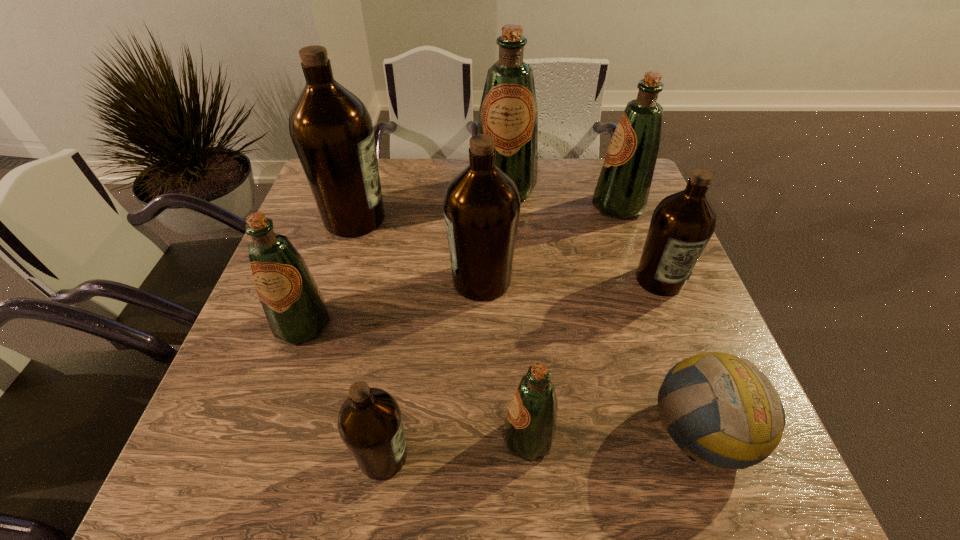
You are a GUI agent. You are given a task and a screenshot of the screen. Output one action in this format:
    pyautogui.click(x=<x>, y=<y>)
    Task: Click on the object that is at the far right corner
    
    Given the screenshot: What is the action you would take?
    pyautogui.click(x=622, y=190)

Image resolution: width=960 pixels, height=540 pixels. Identify the location of object that is at the near right corner. (742, 419).

This screenshot has height=540, width=960. Identify the location of vacant region at the far edge of the desktop. (385, 195).

Image resolution: width=960 pixels, height=540 pixels. What are the coordinates of `blank space at the near edge` in the screenshot? It's located at (463, 461).

Identify the location of free space at the left edge. (306, 264).

Image resolution: width=960 pixels, height=540 pixels. In the image, there is a desktop. In order to click on free region at the right edge in this screenshot , I will do `click(658, 340)`.

The width and height of the screenshot is (960, 540). In the image, there is a desktop. Find the location of `blank space at the far left corner`. blank space at the far left corner is located at coordinates pyautogui.click(x=310, y=203).

Image resolution: width=960 pixels, height=540 pixels. I want to click on vacant area that lies between the third object from left to right and the rightmost green olive oil, so click(x=501, y=331).

Locate an element on the screen. free point between the leftmost green olive oil and the shortest object is located at coordinates [x=503, y=377].

Locate an element on the screen. free spot between the third biggest brown olive oil and the nearest green olive oil is located at coordinates (593, 359).